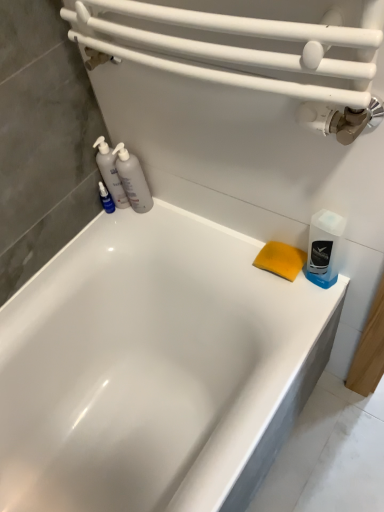
Image resolution: width=384 pixels, height=512 pixels. Identify the location of free space in front of blue translucent bottle at right, which is counted as the third cleaning product, starting from the left. (307, 327).